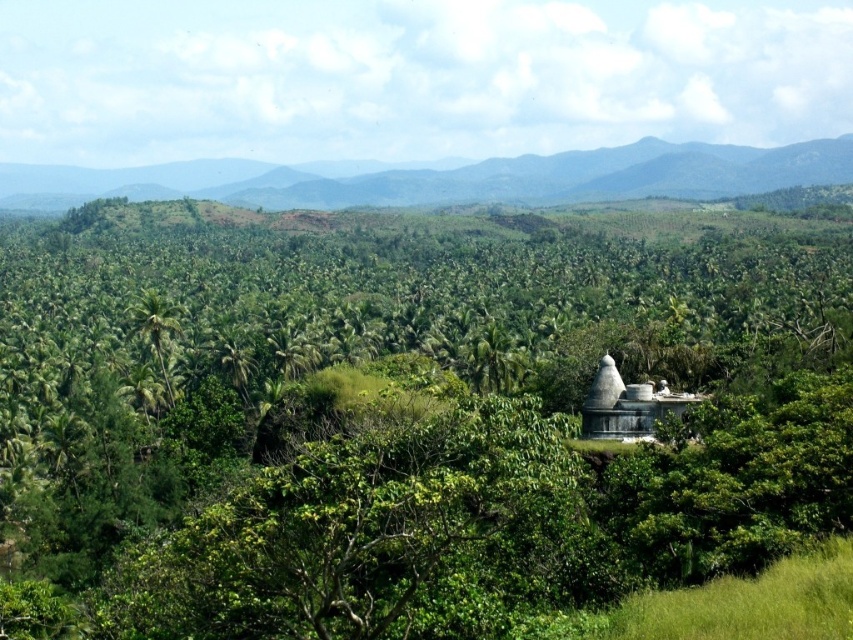
You are standing in the tropical landscape described and want to locate the point at coordinates [410,417]. According to the scene description, where would this point be located?

The point at coordinates [410,417] is on the green leafy tree at center.

You are standing in the tropical landscape and want to take a photo of both the green leafy tree at center and the green leafy palm tree at center. Which one should you position closer to the left side of your camera frame to include both in the photo?

You should position the green leafy palm tree at center closer to the left side of your camera frame because the green leafy tree at center is to the right of it, ensuring both are included in the photo.

You are standing in the tropical landscape and want to take a photo of both the green leafy mountain at upper center and the green leafy palm tree at center. Based on their positions, which object should you adjust your camera to focus on first to include both in the frame?

You should focus on the green leafy palm tree at center first because the green leafy mountain at upper center is to the right of it, so adjusting the camera to include both would require framing from the palm tree towards the mountain on the right.